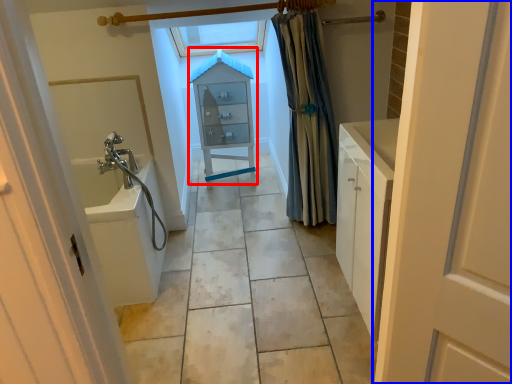
Question: Which object appears farthest to the camera in this image, medicine cabinet (highlighted by a red box) or door (highlighted by a blue box)?

Choices:
 (A) medicine cabinet
 (B) door

Answer: (A)